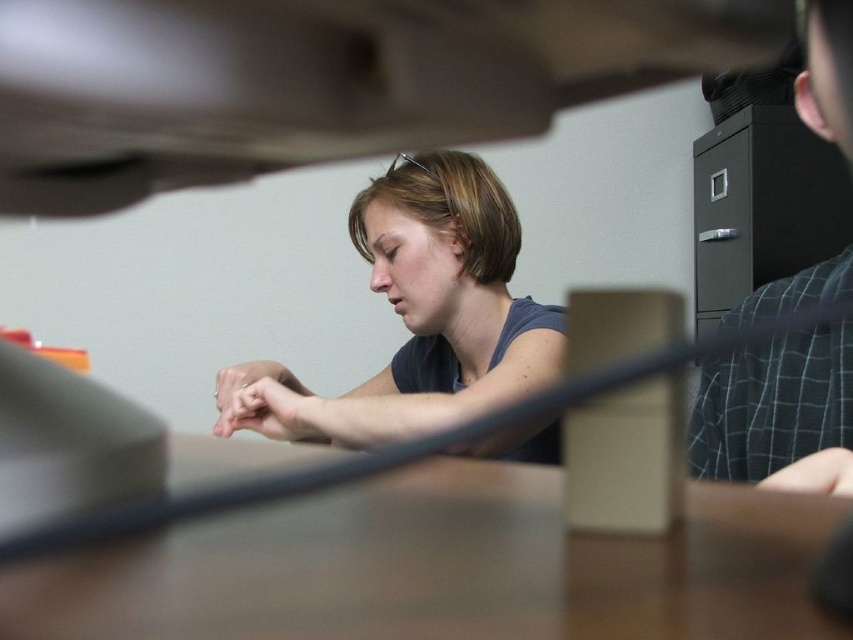
Question: Observing the image, what is the correct spatial positioning of smooth skin hand at lower right in reference to matte black hand at center?

Choices:
 (A) right
 (B) left

Answer: (A)

Question: Can you confirm if plaid shirt at right is smaller than smooth skin hand at lower right?

Choices:
 (A) yes
 (B) no

Answer: (B)

Question: Which point appears closest to the camera in this image?

Choices:
 (A) (229, 394)
 (B) (825, 490)

Answer: (B)

Question: Which of the following is the closest to the observer?

Choices:
 (A) plaid shirt at right
 (B) brown matte table at center
 (C) dark blue fabric at center

Answer: (B)

Question: Which of the following is the closest to the observer?

Choices:
 (A) plaid shirt at right
 (B) matte black hand at center

Answer: (A)

Question: Does brown matte table at center have a greater width compared to plaid shirt at right?

Choices:
 (A) yes
 (B) no

Answer: (A)